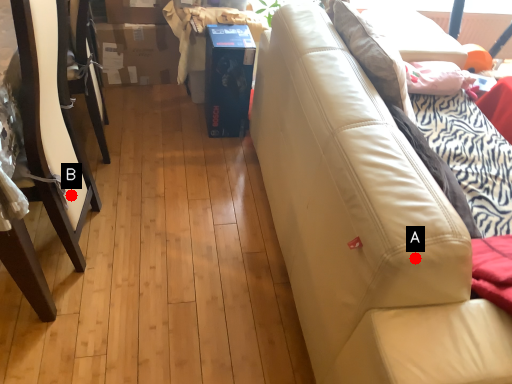
Question: Two points are circled on the image, labeled by A and B beside each circle. Which point is farther to the camera?

Choices:
 (A) A is further
 (B) B is further

Answer: (B)